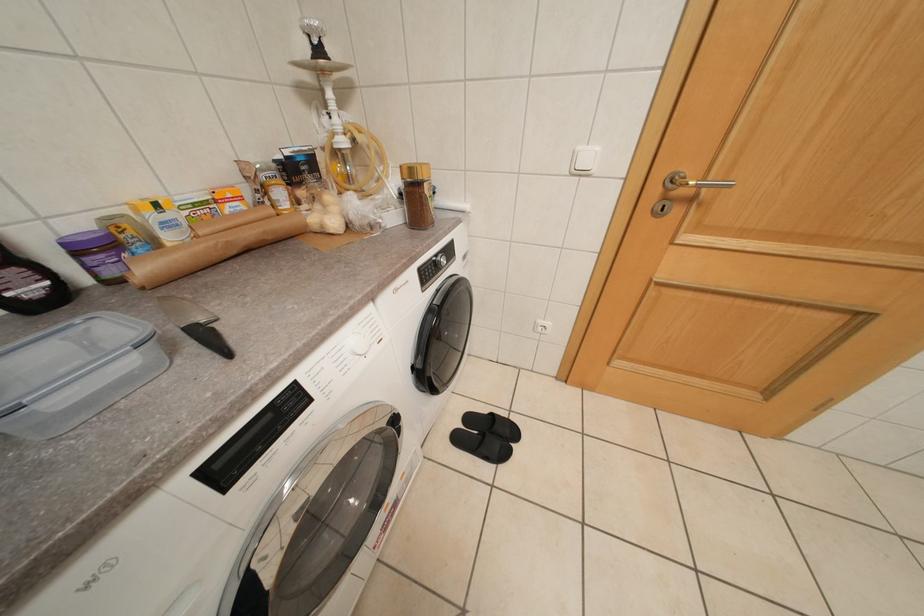
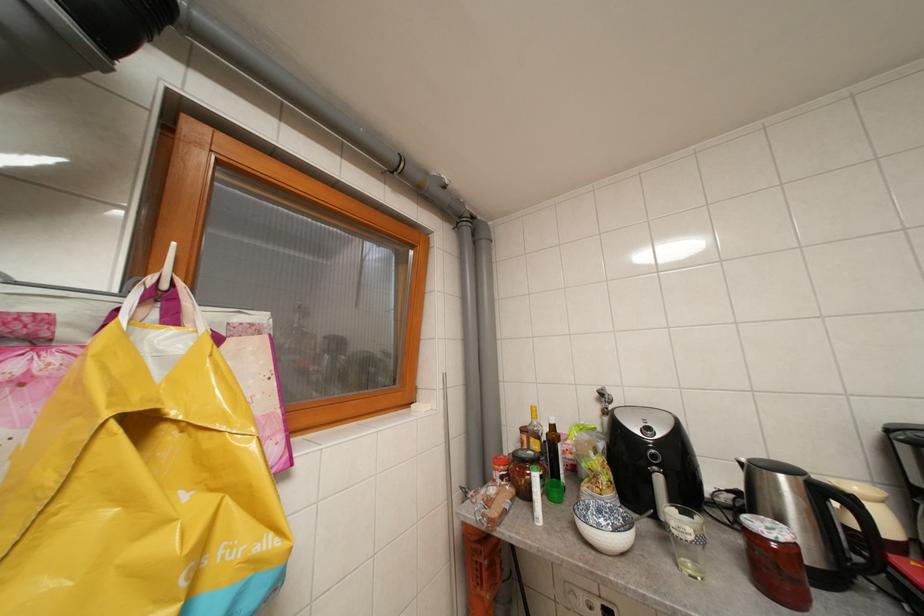
Question: The first image is from the beginning of the video and the second image is from the end. How did the camera likely rotate when shooting the video?

Choices:
 (A) Left
 (B) Right
 (C) Up
 (D) Down

Answer: (A)